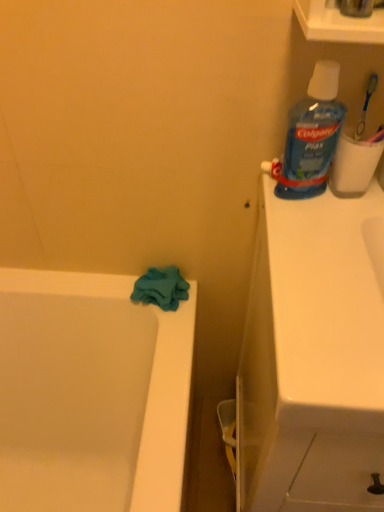
What is the approximate width of teal soft cloth at lower left?

The width of teal soft cloth at lower left is 4.47 inches.

Locate an element on the screen. blue plastic toothbrush at upper right is located at coordinates (366, 105).

Locate an element on the screen. This screenshot has height=512, width=384. blue translucent plastic mouthwash at upper right is located at coordinates (312, 135).

I want to click on teal soft cloth at lower left, so click(161, 288).

Between teal soft cloth at lower left and blue translucent plastic mouthwash at upper right, which one appears on the right side from the viewer's perspective?

From the viewer's perspective, blue translucent plastic mouthwash at upper right appears more on the right side.

Measure the distance from teal soft cloth at lower left to blue translucent plastic mouthwash at upper right.

teal soft cloth at lower left and blue translucent plastic mouthwash at upper right are 43.37 centimeters apart.

Is point (174, 266) positioned behind point (291, 177)?

Yes, it is.

Is teal soft cloth at lower left beside blue translucent plastic mouthwash at upper right?

They are not placed beside each other.

What's the angular difference between blue plastic toothbrush at upper right and blue translucent plastic mouthwash at upper right's facing directions?

The angular difference between blue plastic toothbrush at upper right and blue translucent plastic mouthwash at upper right is 0.963 degrees.

Find the location of a particular element. bottle below the blue plastic toothbrush at upper right (from the image's perspective) is located at coordinates (312, 135).

Is point (360, 135) closer or farther from the camera than point (322, 99)?

Point (360, 135).

Is blue plastic toothbrush at upper right inside the boundaries of blue translucent plastic mouthwash at upper right, or outside?

blue plastic toothbrush at upper right is not inside blue translucent plastic mouthwash at upper right, it's outside.

Between blue translucent plastic mouthwash at upper right and blue plastic toothbrush at upper right, which one has more height?

With more height is blue translucent plastic mouthwash at upper right.

Is blue translucent plastic mouthwash at upper right in contact with blue plastic toothbrush at upper right?

No, blue translucent plastic mouthwash at upper right is not with blue plastic toothbrush at upper right.

Is blue plastic toothbrush at upper right at the back of blue translucent plastic mouthwash at upper right?

No, blue translucent plastic mouthwash at upper right's orientation is not away from blue plastic toothbrush at upper right.

Considering the positions of point (327, 139) and point (359, 127), is point (327, 139) closer or farther from the camera than point (359, 127)?

Point (327, 139) is closer to the camera than point (359, 127).

The height and width of the screenshot is (512, 384). Identify the location of bottle located on the left of white matte toilet paper at upper right. (312, 135).

Which object is closer to the camera taking this photo, blue translucent plastic mouthwash at upper right or white matte toilet paper at upper right?

blue translucent plastic mouthwash at upper right.

Is white matte toilet paper at upper right located within blue translucent plastic mouthwash at upper right?

That's incorrect, white matte toilet paper at upper right is not inside blue translucent plastic mouthwash at upper right.

From a real-world perspective, is blue translucent plastic mouthwash at upper right physically below white matte toilet paper at upper right?

No.

I want to click on bottle on the left of the white matte toilet paper at upper right, so click(x=312, y=135).

Is the surface of white matte toilet paper at upper right in direct contact with blue translucent plastic mouthwash at upper right?

Yes, white matte toilet paper at upper right is touching blue translucent plastic mouthwash at upper right.

From a real-world perspective, is white matte toilet paper at upper right positioned over blue translucent plastic mouthwash at upper right based on gravity?

No, from a real-world perspective, white matte toilet paper at upper right is not above blue translucent plastic mouthwash at upper right.

Is the depth of white matte toilet paper at upper right less than that of blue translucent plastic mouthwash at upper right?

No.

Consider the image. Can you confirm if white glossy sink at upper right is positioned to the right of white matte toilet paper at upper right?

Indeed, white glossy sink at upper right is positioned on the right side of white matte toilet paper at upper right.

Could white matte toilet paper at upper right be considered to be inside white glossy sink at upper right?

No.

Is white glossy sink at upper right oriented away from white matte toilet paper at upper right?

That's not correct — white glossy sink at upper right is not looking away from white matte toilet paper at upper right.

How many degrees apart are the facing directions of white glossy sink at upper right and white matte toilet paper at upper right?

1.79 degrees.

From the image's perspective, between white glossy sink at upper right and blue plastic toothbrush at upper right, which one is located above?

From the image's view, blue plastic toothbrush at upper right is above.

Can you confirm if white glossy sink at upper right is positioned to the left of blue plastic toothbrush at upper right?

No, white glossy sink at upper right is not to the left of blue plastic toothbrush at upper right.

Which object is more forward, white glossy sink at upper right or blue plastic toothbrush at upper right?

white glossy sink at upper right.

Where is `bottle on the right side of teal soft cloth at lower left`? The image size is (384, 512). bottle on the right side of teal soft cloth at lower left is located at coordinates (312, 135).

Where is `toothbrush above the blue translucent plastic mouthwash at upper right (from a real-world perspective)`? toothbrush above the blue translucent plastic mouthwash at upper right (from a real-world perspective) is located at coordinates (366, 105).

Estimate the real-world distances between objects in this image. Which object is further from blue translucent plastic mouthwash at upper right, white matte toilet paper at upper right or teal soft cloth at lower left?

teal soft cloth at lower left is further to blue translucent plastic mouthwash at upper right.

When comparing their distances from blue translucent plastic mouthwash at upper right, does white glossy sink at upper right or blue plastic toothbrush at upper right seem closer?

blue plastic toothbrush at upper right is positioned closer to the anchor blue translucent plastic mouthwash at upper right.

Which object lies nearer to the anchor point white glossy sink at upper right, teal soft cloth at lower left or white matte toilet paper at upper right?

Based on the image, white matte toilet paper at upper right appears to be nearer to white glossy sink at upper right.

Looking at this image, considering their positions, is blue translucent plastic mouthwash at upper right positioned further to blue plastic toothbrush at upper right than white matte toilet paper at upper right?

Based on the image, blue translucent plastic mouthwash at upper right appears to be further to blue plastic toothbrush at upper right.

Looking at this image, which object lies nearer to the anchor point blue translucent plastic mouthwash at upper right, teal soft cloth at lower left or blue plastic toothbrush at upper right?

blue plastic toothbrush at upper right.

When comparing their distances from blue translucent plastic mouthwash at upper right, does blue plastic toothbrush at upper right or white glossy sink at upper right seem further?

Among the two, white glossy sink at upper right is located further to blue translucent plastic mouthwash at upper right.

Looking at the image, which one is located closer to blue plastic toothbrush at upper right, white glossy sink at upper right or teal soft cloth at lower left?

white glossy sink at upper right.

Considering their positions, is teal soft cloth at lower left positioned further to blue plastic toothbrush at upper right than white glossy sink at upper right?

Among the two, teal soft cloth at lower left is located further to blue plastic toothbrush at upper right.

At what (x,y) coordinates should I click in order to perform the action: click on toilet paper located between teal soft cloth at lower left and blue plastic toothbrush at upper right in the left-right direction. Please return your answer as a coordinate pair (x, y). Looking at the image, I should click on (354, 165).

The width and height of the screenshot is (384, 512). What are the coordinates of `bath towel between blue plastic toothbrush at upper right and white glossy sink at upper right vertically` in the screenshot? It's located at (161, 288).

You are a GUI agent. You are given a task and a screenshot of the screen. Output one action in this format:
    pyautogui.click(x=<x>, y=<y>)
    Task: Click on the bottle between teal soft cloth at lower left and white matte toilet paper at upper right from left to right
    The height and width of the screenshot is (512, 384).
    Given the screenshot: What is the action you would take?
    pyautogui.click(x=312, y=135)

Where is `bottle between teal soft cloth at lower left and blue plastic toothbrush at upper right in the horizontal direction`? The height and width of the screenshot is (512, 384). bottle between teal soft cloth at lower left and blue plastic toothbrush at upper right in the horizontal direction is located at coordinates (312, 135).